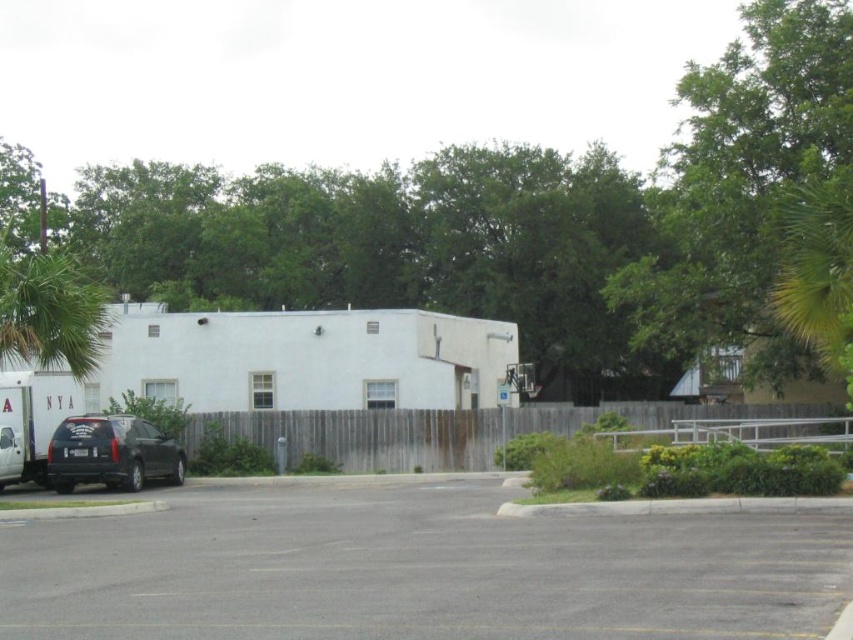
Question: Does gray asphalt parking lot at center appear on the right side of matte black suv at lower left?

Choices:
 (A) no
 (B) yes

Answer: (B)

Question: Is green leafy tree at upper right bigger than green leafy palm tree at left?

Choices:
 (A) yes
 (B) no

Answer: (A)

Question: Which of the following is the closest to the observer?

Choices:
 (A) coord(102,428)
 (B) coord(650,256)

Answer: (A)

Question: Where is gray asphalt parking lot at center located in relation to green leafy tree at upper right in the image?

Choices:
 (A) right
 (B) left

Answer: (B)

Question: Which object is farther from the camera taking this photo?

Choices:
 (A) green leafy palm tree at left
 (B) green leafy tree at upper right

Answer: (A)

Question: Which point is farther to the camera?

Choices:
 (A) (0, 353)
 (B) (250, 592)

Answer: (A)